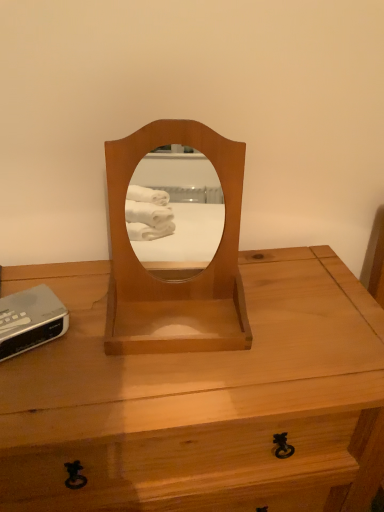
Where is `vacant area that is in front of silver plastic clock at lower left`? This screenshot has height=512, width=384. vacant area that is in front of silver plastic clock at lower left is located at coordinates (35, 396).